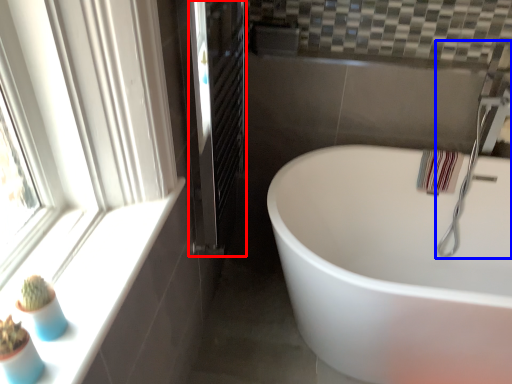
Question: Which point is closer to the camera, screen door (highlighted by a red box) or faucet (highlighted by a blue box)?

Choices:
 (A) screen door
 (B) faucet

Answer: (A)